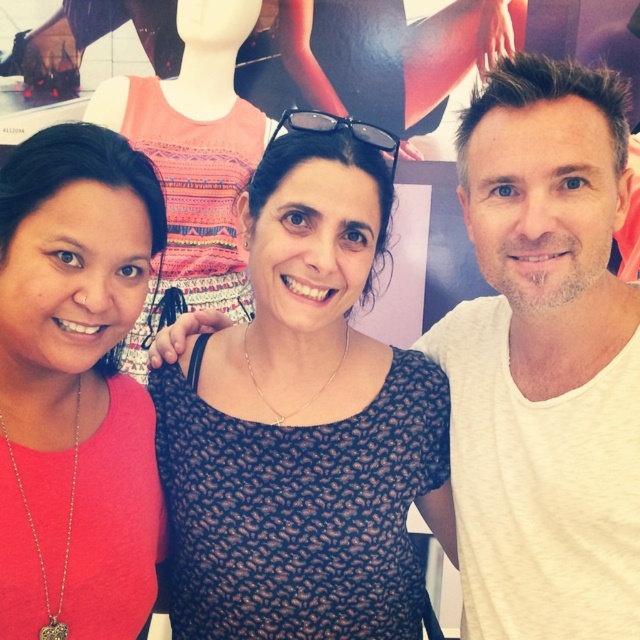
Is pink matte shirt at left smaller than black plastic sunglasses at center?

No, pink matte shirt at left is not smaller than black plastic sunglasses at center.

Is pink matte shirt at left further to camera compared to black plastic sunglasses at center?

No, pink matte shirt at left is in front of black plastic sunglasses at center.

Between point (1, 328) and point (374, 145), which one is positioned behind?

The point (374, 145) is more distant.

Where is `pink matte shirt at left`? pink matte shirt at left is located at coordinates (70, 275).

Does black dotted dress at center have a lesser height compared to white cotton t-shirt at right?

Correct, black dotted dress at center is not as tall as white cotton t-shirt at right.

Who is more forward, (436,474) or (538,496)?

Point (538,496)

Identify the location of black dotted dress at center. This screenshot has width=640, height=640. (305, 420).

Is black dotted dress at center below pink matte shirt at left?

Yes, black dotted dress at center is below pink matte shirt at left.

Locate an element on the screen. Image resolution: width=640 pixels, height=640 pixels. black dotted dress at center is located at coordinates click(305, 420).